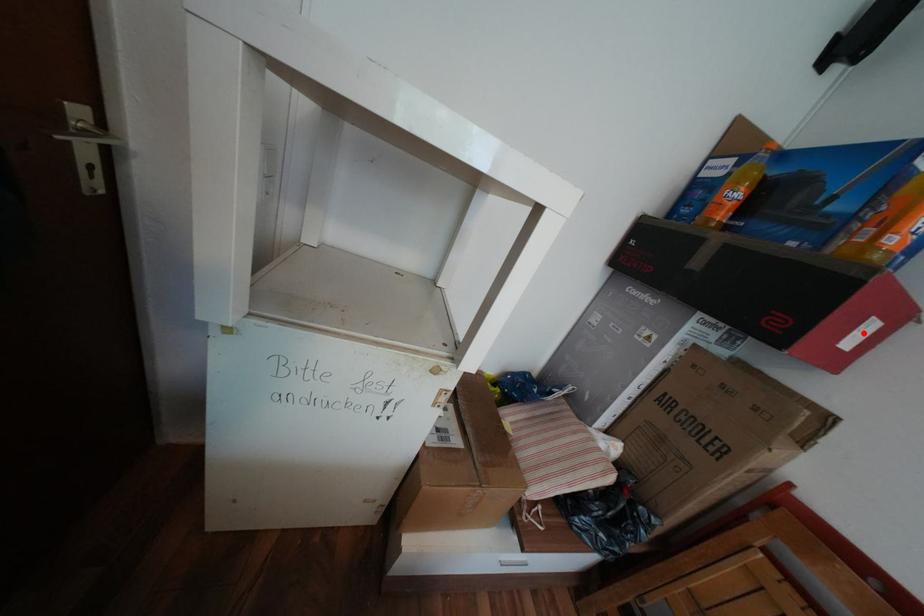
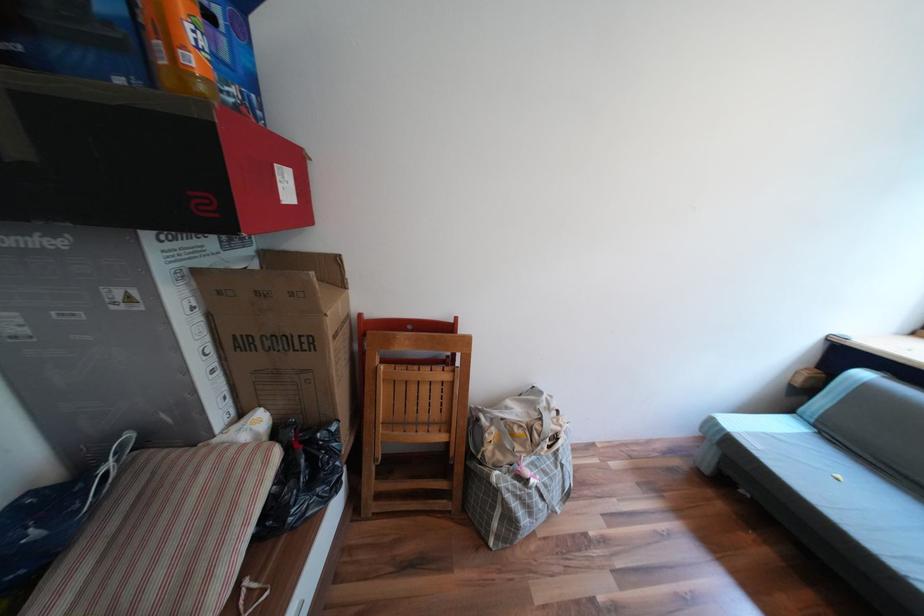
The point at the highlighted location is marked in the first image. Where is the corresponding point in the second image?

(289, 185)